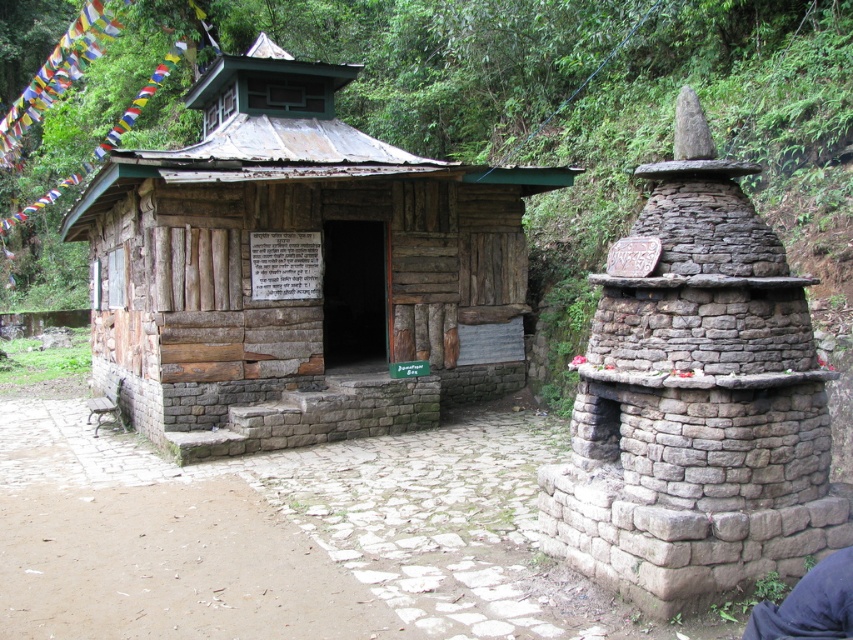
Question: Is rustic wooden hut at center closer to camera compared to dark blue fabric at lower right?

Choices:
 (A) no
 (B) yes

Answer: (A)

Question: Does rustic wooden hut at center have a greater width compared to dark blue fabric at lower right?

Choices:
 (A) no
 (B) yes

Answer: (B)

Question: Is rustic wooden hut at center closer to the viewer compared to dark blue fabric at lower right?

Choices:
 (A) yes
 (B) no

Answer: (B)

Question: Which point is farther to the camera?

Choices:
 (A) (814, 568)
 (B) (502, 381)

Answer: (B)